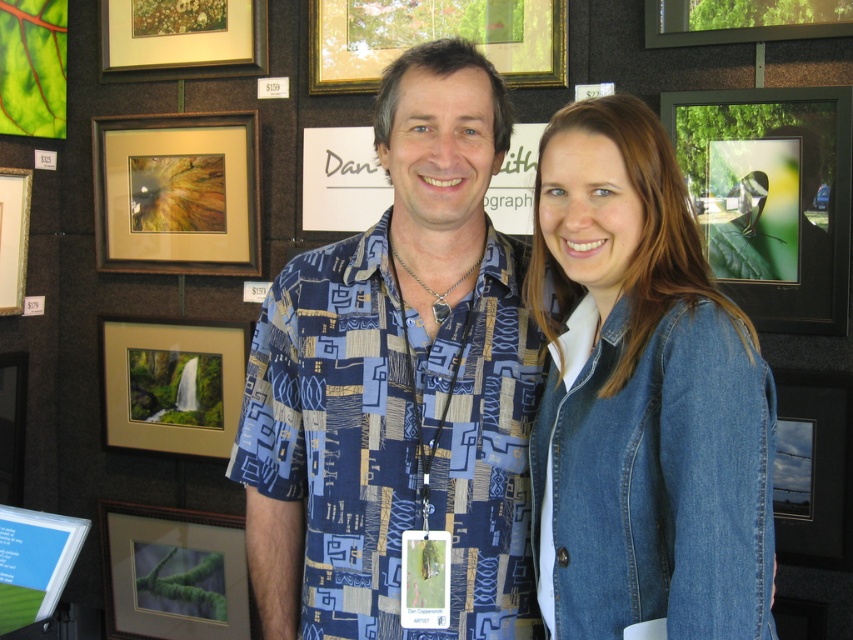
You are a photographer at an art exhibition. You need to adjust the lighting so that the blue printed shirt at center and the gold matte picture frame at center are both well lit. Which object should you move closer to the light source to ensure both are properly illuminated without moving either object?

The blue printed shirt at center is positioned on the right side of the gold matte picture frame at center. To ensure both are properly illuminated, you should move the gold matte picture frame at center closer to the light source since it is blocking the light from reaching the shirt on its right side.

Looking at this image, you are a photographer standing in the gallery and want to capture a wide shot of both the denim jacket at lower right and the green matte branch at lower left in the same frame. The camera you are using has a maximum horizontal field of view of 2 meters. Can you fit both objects in the frame without moving the camera?

The denim jacket at lower right and the green matte branch at lower left are 1.96 meters apart from each other. Since the camera has a maximum horizontal field of view of 2 meters, you can fit both objects in the frame without moving the camera because the distance between them is within the camera range.

You are a photographer trying to capture a clear shot of both the blue printed shirt at center and the gold matte picture frame at center. Since you want to focus on the shirt first, which object should you adjust your camera focus to first and why?

The blue printed shirt at center is thinner than the gold matte picture frame at center, so you should focus on the blue printed shirt at center first because thinner objects require precise focus to capture details clearly before adjusting to larger objects.